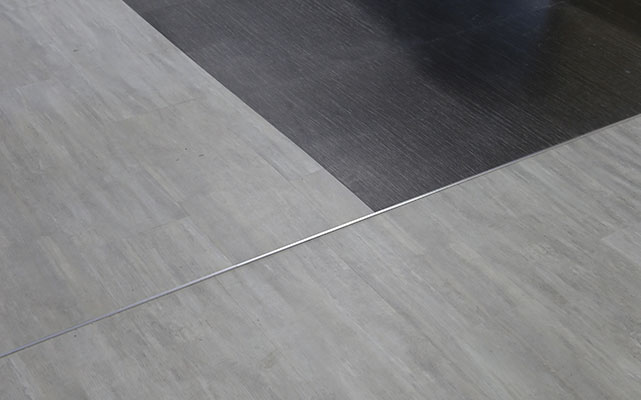
Where is `dark spots in gray flooring`? dark spots in gray flooring is located at coordinates (200, 154), (185, 147), (179, 160).